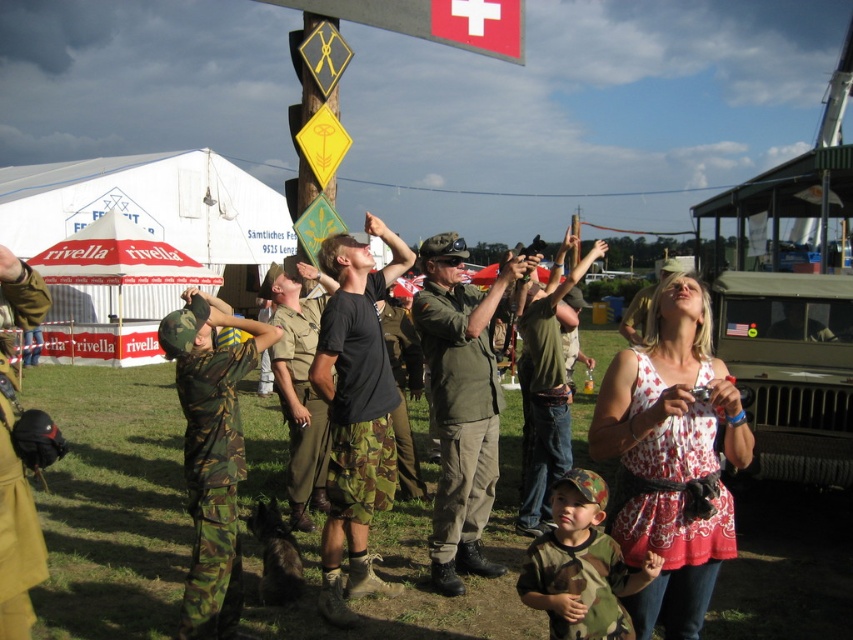
Can you confirm if camo fabric uniform at center is positioned to the right of camouflage fabric uniform at center?

No, camo fabric uniform at center is not to the right of camouflage fabric uniform at center.

Does camo fabric uniform at center have a smaller size compared to camouflage fabric uniform at center?

Yes, camo fabric uniform at center is smaller than camouflage fabric uniform at center.

Is point (227, 376) positioned after point (399, 456)?

No, (227, 376) is closer to viewer.

You are a GUI agent. You are given a task and a screenshot of the screen. Output one action in this format:
    pyautogui.click(x=<x>, y=<y>)
    Task: Click on the camo fabric uniform at center
    
    Given the screenshot: What is the action you would take?
    pyautogui.click(x=212, y=484)

Does black cotton t-shirt at center have a greater width compared to camo fabric shirt at lower center?

Correct, the width of black cotton t-shirt at center exceeds that of camo fabric shirt at lower center.

Can you confirm if black cotton t-shirt at center is bigger than camo fabric shirt at lower center?

Yes.

Where is `black cotton t-shirt at center`? This screenshot has width=853, height=640. black cotton t-shirt at center is located at coordinates (355, 412).

Find the location of a particular element. black cotton t-shirt at center is located at coordinates (355, 412).

Is white printed fabric dress at lower right shorter than camouflage fabric pants at center?

Yes, white printed fabric dress at lower right is shorter than camouflage fabric pants at center.

Can you confirm if white printed fabric dress at lower right is positioned below camouflage fabric pants at center?

Indeed, white printed fabric dress at lower right is positioned under camouflage fabric pants at center.

The height and width of the screenshot is (640, 853). Describe the element at coordinates (674, 518) in the screenshot. I see `white printed fabric dress at lower right` at that location.

You are a GUI agent. You are given a task and a screenshot of the screen. Output one action in this format:
    pyautogui.click(x=<x>, y=<y>)
    Task: Click on the white printed fabric dress at lower right
    
    Given the screenshot: What is the action you would take?
    pyautogui.click(x=674, y=518)